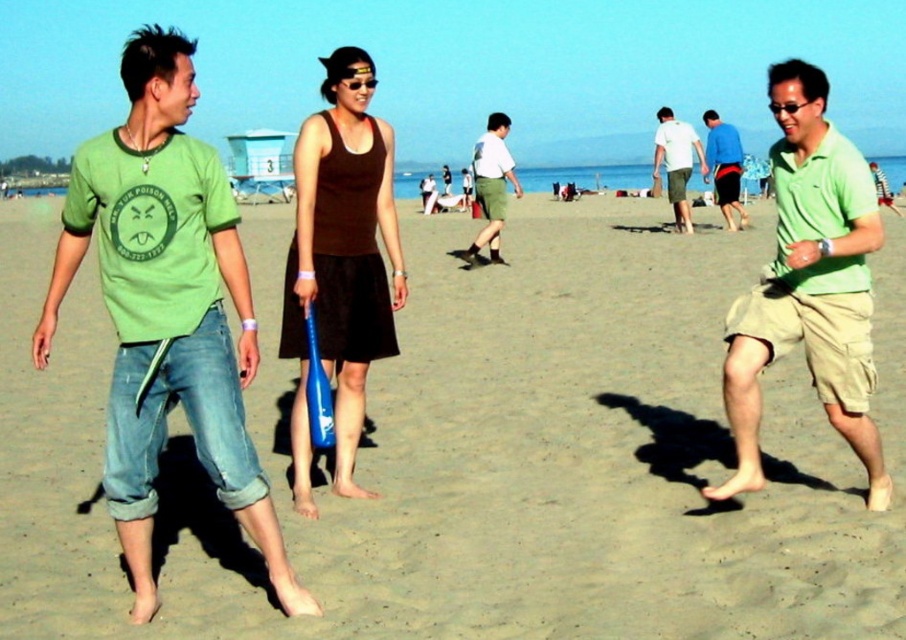
Question: Observing the image, what is the correct spatial positioning of green matte t-shirt at left in reference to blue fabric shorts at center?

Choices:
 (A) right
 (B) left

Answer: (B)

Question: Which object appears farthest from the camera in this image?

Choices:
 (A) green matte t-shirt at left
 (B) smooth tan sand at center
 (C) light blue cotton shirt at center
 (D) green matte shirt at center

Answer: (C)

Question: Which of the following is the closest to the observer?

Choices:
 (A) (103, 172)
 (B) (297, 300)

Answer: (A)

Question: Which point is closer to the camera?

Choices:
 (A) green matte shirt at center
 (B) light blue cotton shirt at center

Answer: (A)

Question: Is green matte t-shirt at left bigger than blue fabric shorts at center?

Choices:
 (A) no
 (B) yes

Answer: (A)

Question: Can you confirm if green matte shirt at center is smaller than light blue cotton shirt at center?

Choices:
 (A) yes
 (B) no

Answer: (A)